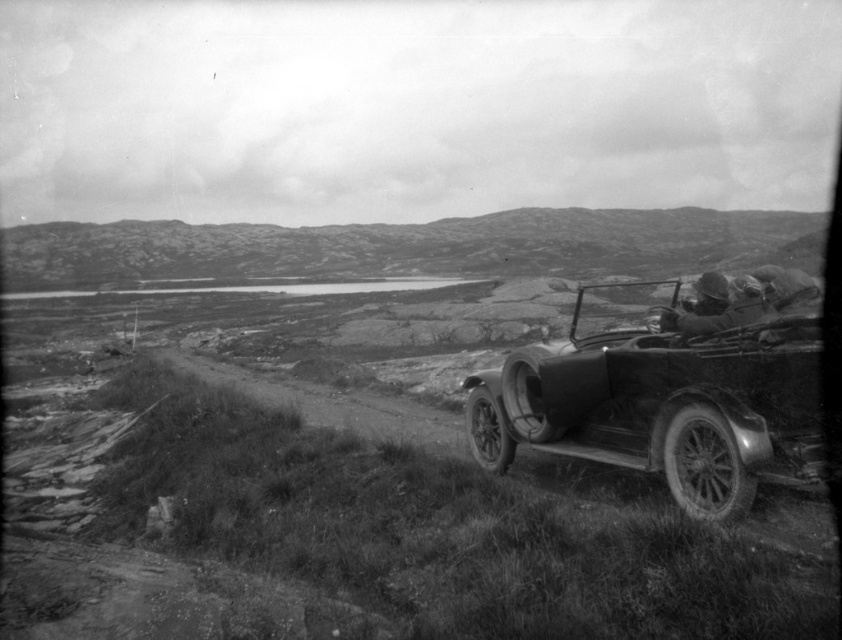
Between shiny chrome car at right and rugged stone hillside at upper center, which one has more height?

With more height is rugged stone hillside at upper center.

Find the location of a particular element. shiny chrome car at right is located at coordinates [664, 403].

The image size is (842, 640). I want to click on shiny chrome car at right, so click(x=664, y=403).

Between shiny chrome car at right and dirt/gritty road at lower left, which one is positioned lower?

Positioned lower is dirt/gritty road at lower left.

Where is `shiny chrome car at right`? Image resolution: width=842 pixels, height=640 pixels. shiny chrome car at right is located at coordinates (664, 403).

Does rugged stone hillside at upper center come in front of dirt/gritty road at lower left?

That is False.

Looking at this image, does rugged stone hillside at upper center have a greater height compared to dirt/gritty road at lower left?

Correct, rugged stone hillside at upper center is much taller as dirt/gritty road at lower left.

Who is more forward, (496, 272) or (227, 385)?

Point (227, 385) is in front.

At what (x,y) coordinates should I click in order to perform the action: click on rugged stone hillside at upper center. Please return your answer as a coordinate pair (x, y). Image resolution: width=842 pixels, height=640 pixels. Looking at the image, I should click on (408, 246).